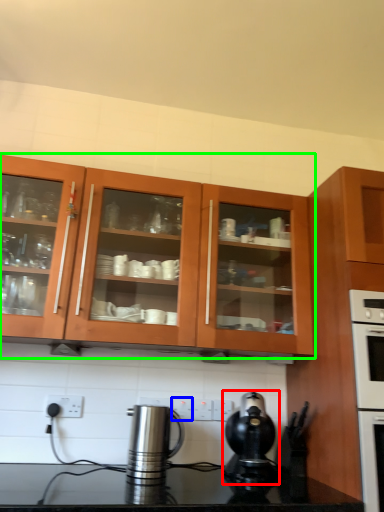
Question: Which is nearer to the kitchen appliance (highlighted by a red box)? electric outlet (highlighted by a blue box) or cabinetry (highlighted by a green box).

Choices:
 (A) electric outlet
 (B) cabinetry

Answer: (A)